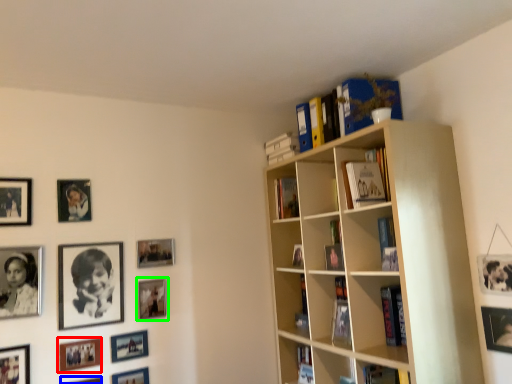
Question: Which object is the closest to the picture frame (highlighted by a red box)? Choose among these: picture frame (highlighted by a blue box) or picture frame (highlighted by a green box).

Choices:
 (A) picture frame
 (B) picture frame

Answer: (A)